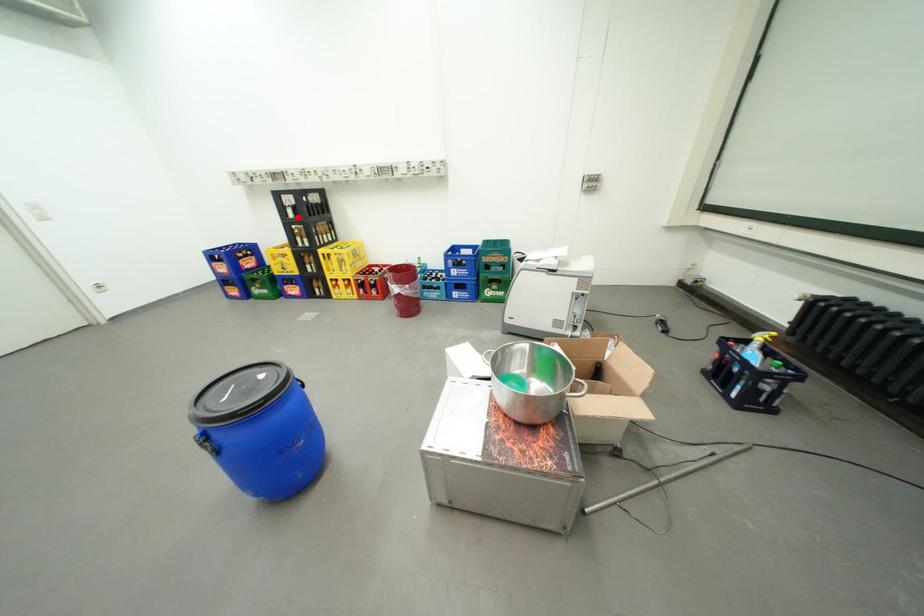
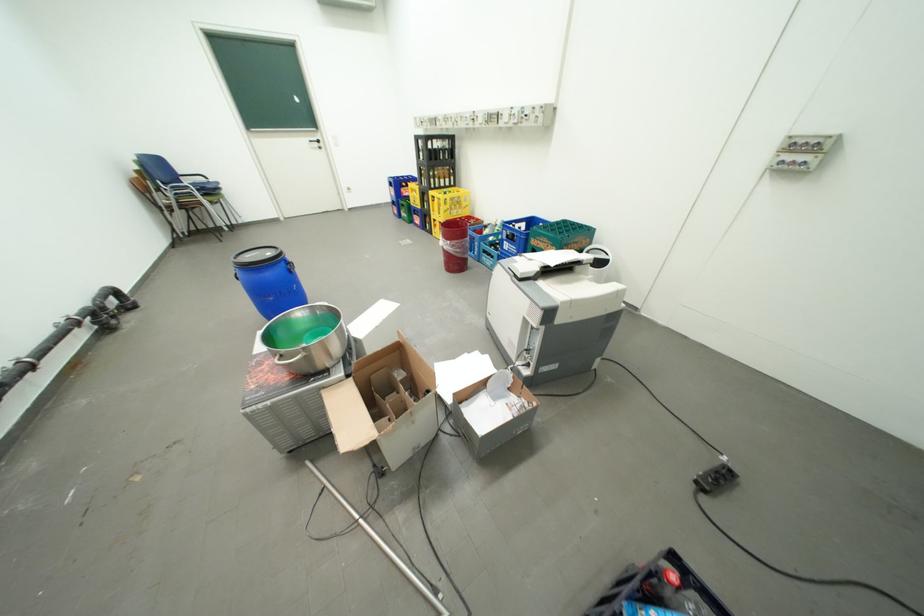
The point at the highlighted location is marked in the first image. Where is the corresponding point in the second image?

(430, 159)